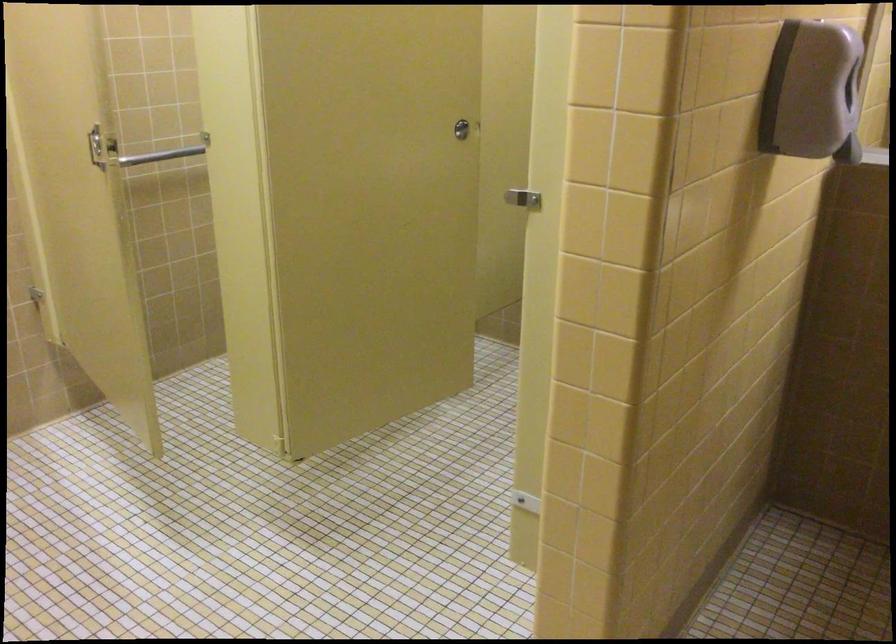
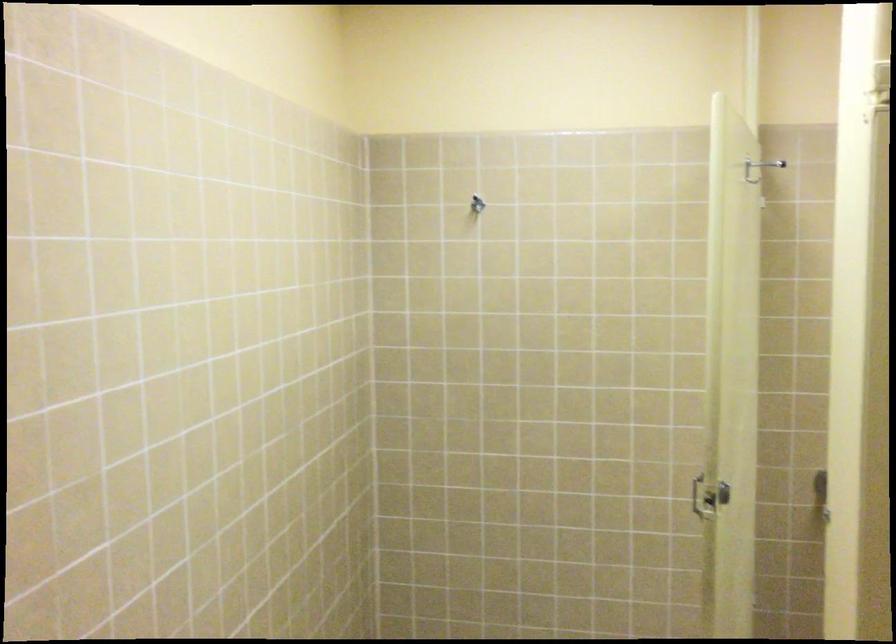
Question: The images are taken continuously from a first-person perspective. In which direction is your viewpoint rotating?

Choices:
 (A) Left
 (B) Right
 (C) Up
 (D) Down

Answer: (A)